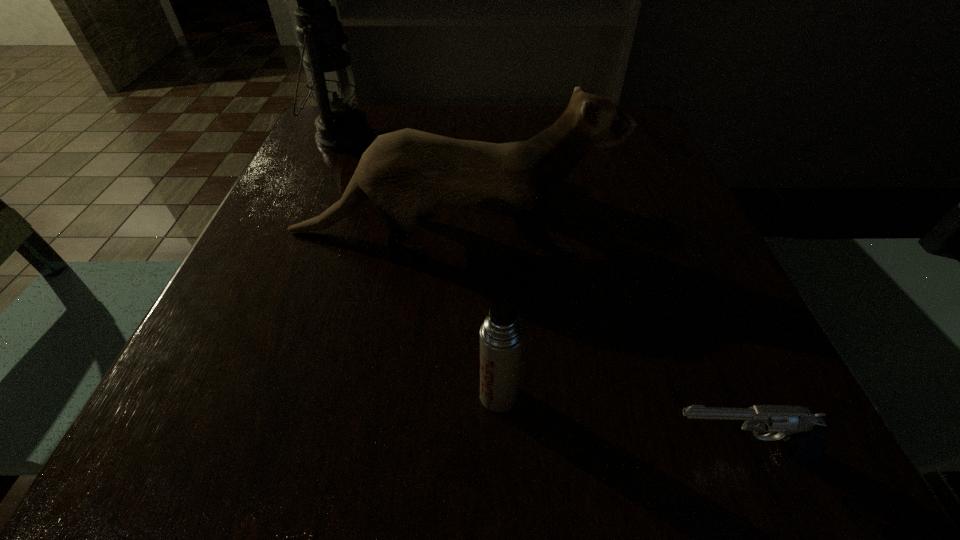
This screenshot has height=540, width=960. What are the coordinates of `free point located 0.220m on the back of the second shortest object` in the screenshot? It's located at (494, 262).

At what (x,y) coordinates should I click in order to perform the action: click on vacant space situated at the muzzle of the nearest object. Please return your answer as a coordinate pair (x, y). Looking at the image, I should click on (504, 452).

The width and height of the screenshot is (960, 540). Find the location of `vacant space located at the muzzle of the nearest object`. vacant space located at the muzzle of the nearest object is located at coordinates (348, 452).

I want to click on vacant point located at the muzzle of the nearest object, so coord(521,452).

The height and width of the screenshot is (540, 960). I want to click on object situated at the far edge, so click(x=340, y=127).

Where is `thermos bottle present at the near edge`? thermos bottle present at the near edge is located at coordinates (501, 335).

Find the location of a particular element. gun that is positioned at the near edge is located at coordinates (803, 432).

I want to click on oil lamp present at the left edge, so click(x=340, y=127).

Locate an element on the screen. The image size is (960, 540). ferret that is at the left edge is located at coordinates point(406,173).

This screenshot has height=540, width=960. Find the location of `object located at the right edge`. object located at the right edge is located at coordinates (803, 432).